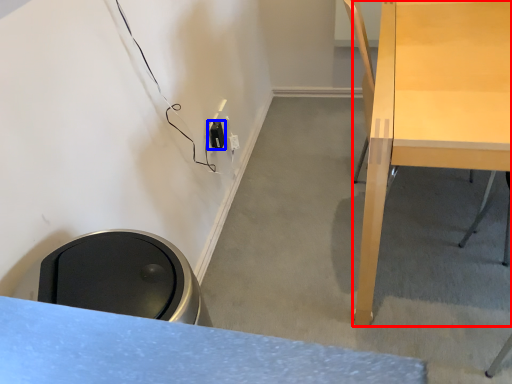
Question: Which of the following is the farthest to the observer, desk (highlighted by a red box) or electric outlet (highlighted by a blue box)?

Choices:
 (A) desk
 (B) electric outlet

Answer: (B)